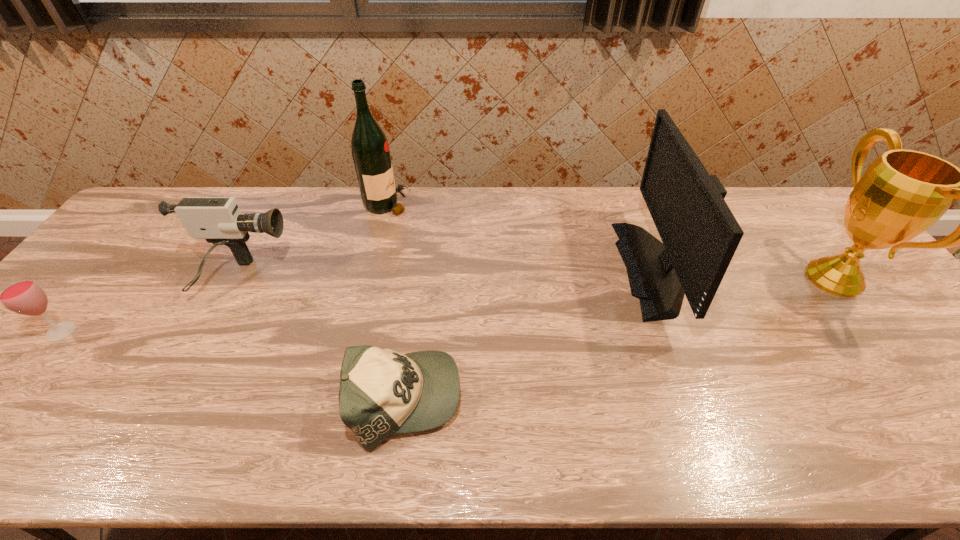
Image resolution: width=960 pixels, height=540 pixels. Identify the location of vacant space that is in between the baseball cap and the award. (619, 339).

The image size is (960, 540). I want to click on unoccupied position between the rightmost object and the wineglass, so click(447, 305).

At what (x,y) coordinates should I click in order to perform the action: click on free point between the wine bottle and the fifth object from left to right. Please return your answer as a coordinate pair (x, y). The width and height of the screenshot is (960, 540). Looking at the image, I should click on (524, 236).

You are a GUI agent. You are given a task and a screenshot of the screen. Output one action in this format:
    pyautogui.click(x=<x>, y=<y>)
    Task: Click on the free spot between the monitor and the wine bottle
    
    Given the screenshot: What is the action you would take?
    pyautogui.click(x=524, y=236)

Find the location of `free space between the award and the fifth tallest object`. free space between the award and the fifth tallest object is located at coordinates (447, 305).

Identify the location of vacant space that is in between the fourth tallest object and the wine bottle. (313, 241).

Find the location of a particular element. The image size is (960, 540). free space between the award and the nearest object is located at coordinates (619, 339).

This screenshot has height=540, width=960. Identify the location of vacant point located between the wine bottle and the monitor. (524, 236).

Find the location of a particular element. empty space that is in between the monitor and the shortest object is located at coordinates (533, 334).

Where is `empty location between the second object from right to left and the wine bottle`? The width and height of the screenshot is (960, 540). empty location between the second object from right to left and the wine bottle is located at coordinates (524, 236).